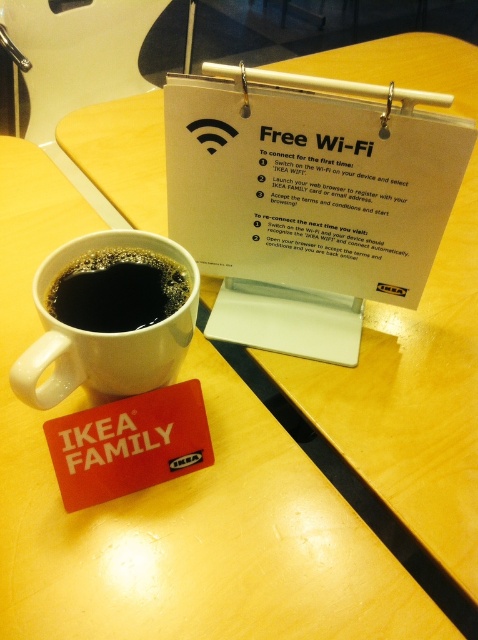
Question: Observing the image, what is the correct spatial positioning of white matte mug at upper left in reference to black matte cup at lower left?

Choices:
 (A) below
 (B) above

Answer: (A)

Question: Among these points, which one is farthest from the camera?

Choices:
 (A) (82, 380)
 (B) (176, 104)
 (C) (61, 282)

Answer: (B)

Question: Is white plastic clipboard at upper center smaller than black matte cup at lower left?

Choices:
 (A) yes
 (B) no

Answer: (B)

Question: Which object is farther from the camera taking this photo?

Choices:
 (A) white plastic clipboard at upper center
 (B) black matte cup at lower left

Answer: (A)

Question: Estimate the real-world distances between objects in this image. Which object is closer to the white plastic clipboard at upper center?

Choices:
 (A) black matte cup at lower left
 (B) white matte mug at upper left

Answer: (B)

Question: Can you confirm if white matte mug at upper left is thinner than black matte cup at lower left?

Choices:
 (A) no
 (B) yes

Answer: (A)